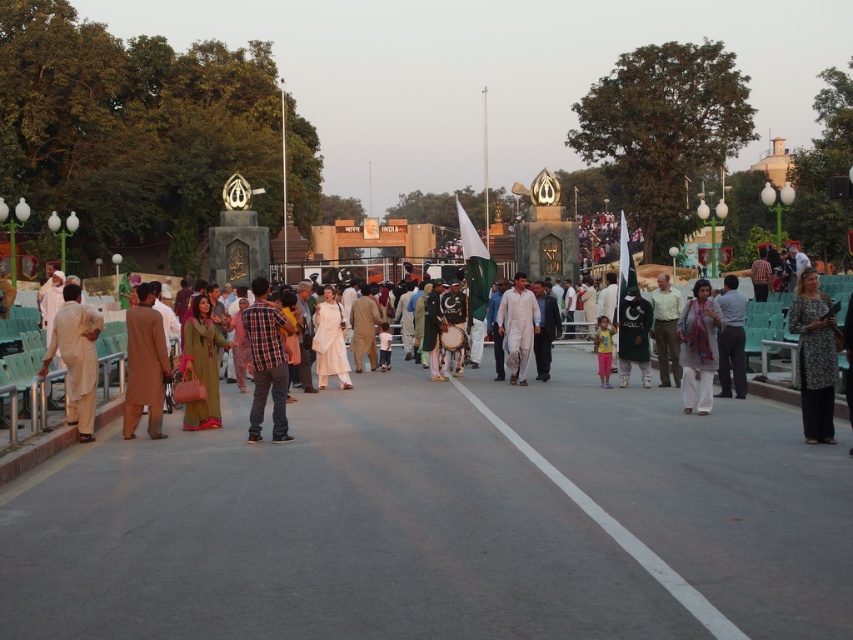
You are attending a cultural event and see two people dressed in traditional attire. One is wearing a plaid shirt at center and the other a white cotton kurta at center. Which clothing item is closer to the ground?

The plaid shirt at center is positioned under the white cotton kurta at center, meaning it is closer to the ground.